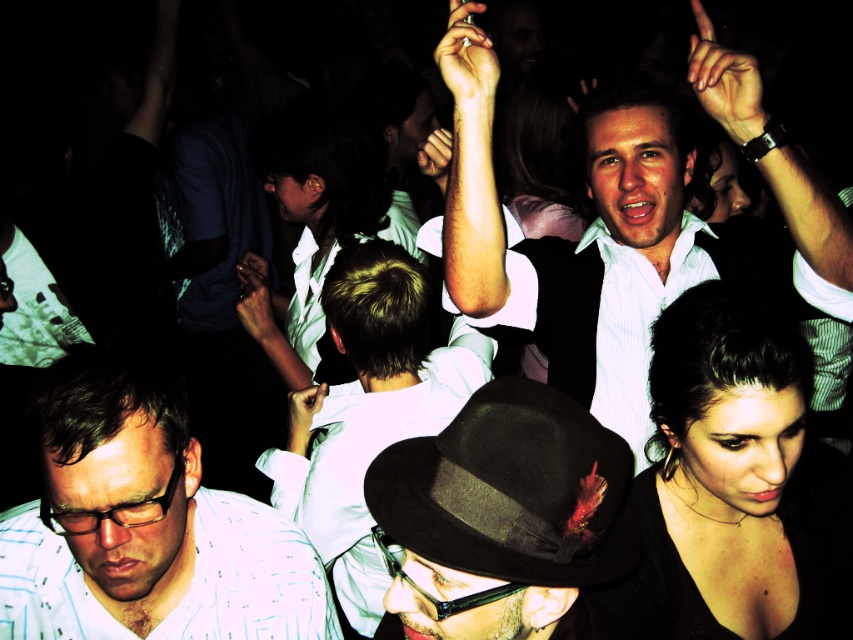
Is black matte dress at lower right thinner than white glossy shirt at center?

Correct, black matte dress at lower right's width is less than white glossy shirt at center's.

Is black matte dress at lower right closer to camera compared to white glossy shirt at center?

That is True.

Where is `black matte dress at lower right`? The width and height of the screenshot is (853, 640). black matte dress at lower right is located at coordinates (732, 486).

Can you confirm if white shirt at center is bigger than white glossy shirt at center?

No.

Can you confirm if white shirt at center is wider than white glossy shirt at center?

Yes.

Describe the element at coordinates (364, 412) in the screenshot. I see `white shirt at center` at that location.

Where is `white shirt at center`? This screenshot has height=640, width=853. white shirt at center is located at coordinates (364, 412).

Can you confirm if white dotted shirt at lower left is bigger than white glossy shirt at center?

No.

Does white dotted shirt at lower left appear over white glossy shirt at center?

Incorrect, white dotted shirt at lower left is not positioned above white glossy shirt at center.

Find the location of a particular element. Image resolution: width=853 pixels, height=640 pixels. white dotted shirt at lower left is located at coordinates (144, 524).